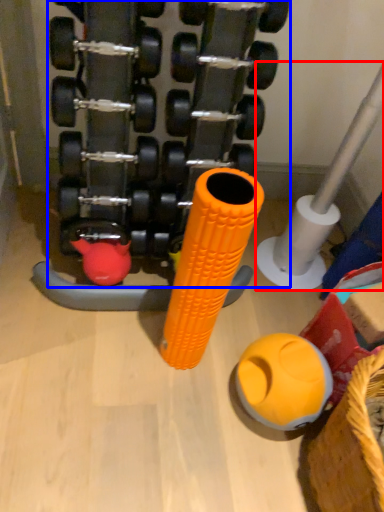
Question: Among these objects, which one is farthest to the camera, pipe (highlighted by a red box) or dumbbell (highlighted by a blue box)?

Choices:
 (A) pipe
 (B) dumbbell

Answer: (A)